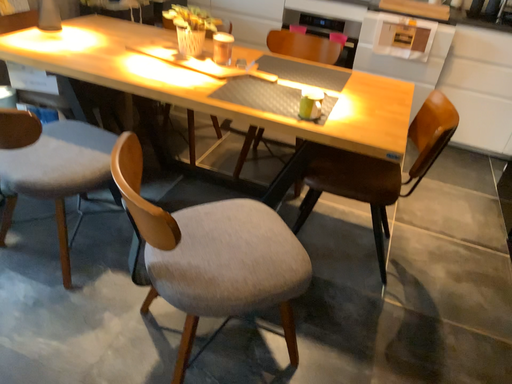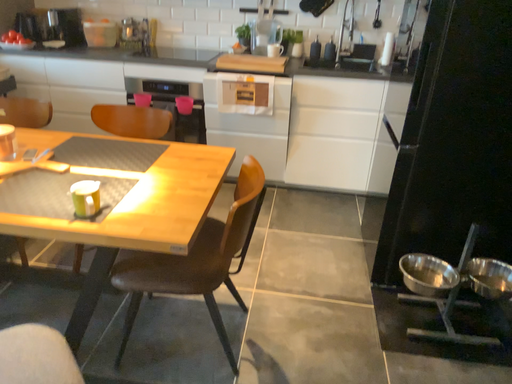
Question: How did the camera likely rotate when shooting the video?

Choices:
 (A) rotated downward
 (B) rotated upward

Answer: (B)